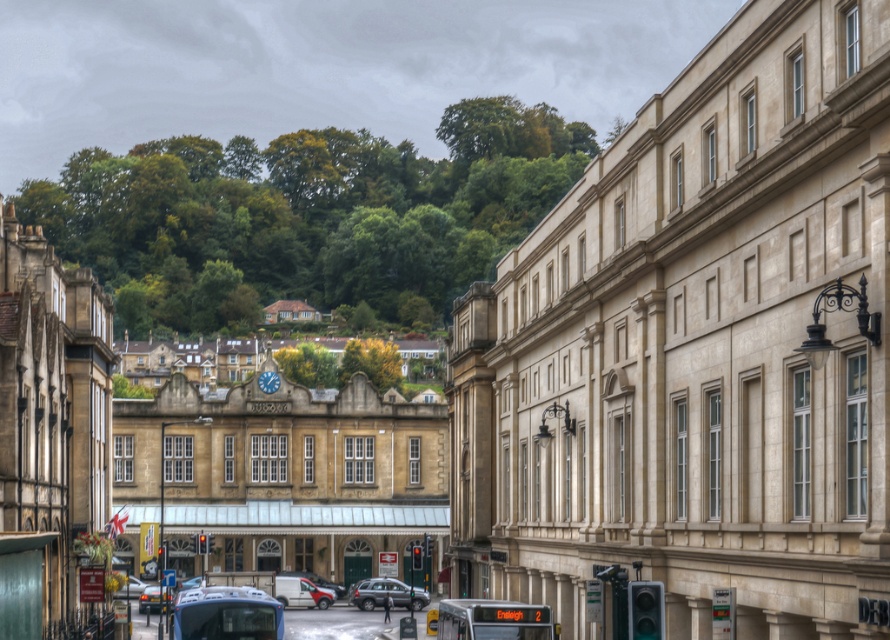
Question: Among these objects, which one is farthest from the camera?

Choices:
 (A) matte black car at lower left
 (B) metallic silver bus at center
 (C) metallic silver bus at lower center

Answer: (A)

Question: Is matte white van at center below matte black car at lower left?

Choices:
 (A) yes
 (B) no

Answer: (A)

Question: Estimate the real-world distances between objects in this image. Which object is farther from the metallic silver bus at lower center?

Choices:
 (A) matte black car at lower left
 (B) matte white van at center
 (C) silver metallic van at center

Answer: (B)

Question: Does matte white van at center appear under matte black car at lower left?

Choices:
 (A) yes
 (B) no

Answer: (A)

Question: Which point is closer to the camera taking this photo?

Choices:
 (A) (329, 593)
 (B) (375, 600)

Answer: (B)

Question: Can you confirm if matte white van at center is bigger than matte black car at lower left?

Choices:
 (A) yes
 (B) no

Answer: (B)